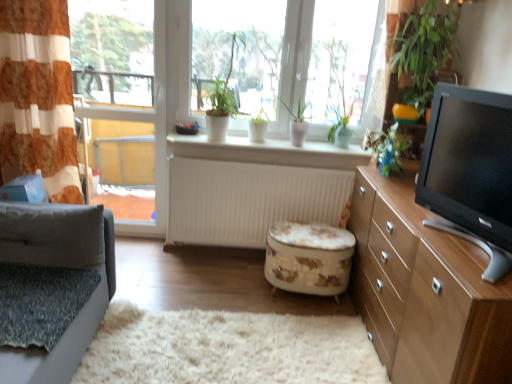
This screenshot has width=512, height=384. Describe the element at coordinates (470, 170) in the screenshot. I see `black glossy tv at right` at that location.

Where is `black glossy tv at right`? The width and height of the screenshot is (512, 384). black glossy tv at right is located at coordinates coord(470,170).

The height and width of the screenshot is (384, 512). What do you see at coordinates (425, 291) in the screenshot? I see `light brown wood cabinet at right` at bounding box center [425, 291].

Image resolution: width=512 pixels, height=384 pixels. Describe the element at coordinates (38, 96) in the screenshot. I see `orange striped fabric at left` at that location.

The image size is (512, 384). I want to click on floral-patterned fabric ottoman at center, so click(x=309, y=258).

Describe the element at coordinates (387, 148) in the screenshot. I see `green matte plant at upper right, marked as the second plant in a top-to-bottom arrangement` at that location.

Find the location of `clear glass window at left`. clear glass window at left is located at coordinates 139,109.

Describe the element at coordinates (423, 51) in the screenshot. I see `green leafy plant at upper right` at that location.

This screenshot has width=512, height=384. What are the coordinates of `white matte window sill at center` in the screenshot? It's located at (268, 152).

From the image's perspective, is white glossy plants at upper center located above or below black glossy tv at right?

Clearly, from the image's perspective, white glossy plants at upper center is above black glossy tv at right.

From a real-world perspective, is white glossy plants at upper center positioned above or below black glossy tv at right?

white glossy plants at upper center is situated higher than black glossy tv at right in the real world.

Does white matte window sill at center have a smaller size compared to gray fabric studio couch at left?

Correct, white matte window sill at center occupies less space than gray fabric studio couch at left.

Is white matte window sill at center thinner than gray fabric studio couch at left?

Indeed, white matte window sill at center has a lesser width compared to gray fabric studio couch at left.

Which object is further away from the camera taking this photo, white matte window sill at center or gray fabric studio couch at left?

white matte window sill at center.

At what (x,y) coordinates should I click in order to perform the action: click on studio couch below the white matte window sill at center (from the image's perspective). Please return your answer as a coordinate pair (x, y). The image size is (512, 384). Looking at the image, I should click on (51, 287).

Identify the location of plant that is the 2nd object located above the light brown wood cabinet at right (from the image's perspective). (225, 86).

Between light brown wood cabinet at right and green matte plant at center, positioned as the 1th plant in top-to-bottom order, which one has more height?

With more height is light brown wood cabinet at right.

Which point is more forward, (372,326) or (213,103)?

The point (372,326) is closer.

Is point (53, 103) behind point (364, 231)?

That is True.

Would you say orange striped fabric at left is inside or outside light brown wood cabinet at right?

orange striped fabric at left is not inside light brown wood cabinet at right, it's outside.

Considering the relative sizes of orange striped fabric at left and light brown wood cabinet at right in the image provided, is orange striped fabric at left smaller than light brown wood cabinet at right?

Yes.

Is orange striped fabric at left aimed at light brown wood cabinet at right?

No, orange striped fabric at left is not facing towards light brown wood cabinet at right.

In the image, is floral-patterned fabric ottoman at center positioned in front of or behind green leafy plant at upper right?

floral-patterned fabric ottoman at center is behind green leafy plant at upper right.

Considering the positions of point (329, 257) and point (395, 52), is point (329, 257) closer or farther from the camera than point (395, 52)?

Point (329, 257) appears to be closer to the viewer than point (395, 52).

Does floral-patterned fabric ottoman at center touch green leafy plant at upper right?

No, floral-patterned fabric ottoman at center is not next to green leafy plant at upper right.

From the image's perspective, relative to green leafy plant at upper right, is floral-patterned fabric ottoman at center above or below?

From the image's perspective, floral-patterned fabric ottoman at center appears below green leafy plant at upper right.

Relative to green matte plant at upper right, the 2th plant when ordered from left to right, is orange striped fabric at left in front or behind?

Visually, orange striped fabric at left is located in front of green matte plant at upper right, the 2th plant when ordered from left to right.

Which of these two, orange striped fabric at left or green matte plant at upper right, marked as the second plant in a top-to-bottom arrangement, stands shorter?

With less height is green matte plant at upper right, marked as the second plant in a top-to-bottom arrangement.

Would you say orange striped fabric at left is to the left or to the right of green matte plant at upper right, marked as the first plant in a right-to-left arrangement, in the picture?

orange striped fabric at left is positioned on green matte plant at upper right, marked as the first plant in a right-to-left arrangement,'s left side.

Is green matte plant at upper right, which ranks as the 1th plant in bottom-to-top order, at the back of orange striped fabric at left?

No, orange striped fabric at left is not facing the opposite direction of green matte plant at upper right, which ranks as the 1th plant in bottom-to-top order.

Is green matte plant at upper right, which ranks as the 1th plant in bottom-to-top order, smaller than green leafy plant at upper right?

Yes.

Considering their positions, is green matte plant at upper right, the 2th plant when ordered from left to right, located in front of or behind green leafy plant at upper right?

green matte plant at upper right, the 2th plant when ordered from left to right, is positioned farther from the viewer than green leafy plant at upper right.

Where is `plant that is the 1st object located behind the green leafy plant at upper right`? The width and height of the screenshot is (512, 384). plant that is the 1st object located behind the green leafy plant at upper right is located at coordinates (387, 148).

Identify the location of television in front of the white glossy plants at upper center. (470, 170).

Image resolution: width=512 pixels, height=384 pixels. In order to click on window sill to the right of gray fabric studio couch at left in this screenshot , I will do `click(268, 152)`.

Estimate the real-world distances between objects in this image. Which object is further from green matte plant at upper right, which ranks as the 1th plant in bottom-to-top order, white glossy plants at upper center or gray fabric studio couch at left?

Among the two, gray fabric studio couch at left is located further to green matte plant at upper right, which ranks as the 1th plant in bottom-to-top order.

Estimate the real-world distances between objects in this image. Which object is further from white matte window sill at center, white matte radiator at center or orange striped fabric at left?

Among the two, orange striped fabric at left is located further to white matte window sill at center.

Estimate the real-world distances between objects in this image. Which object is further from floral-patterned fabric ottoman at center, black glossy tv at right or green leafy plant at upper right?

The object further to floral-patterned fabric ottoman at center is green leafy plant at upper right.

When comparing their distances from light brown wood cabinet at right, does black glossy tv at right or gray fabric studio couch at left seem further?

Among the two, gray fabric studio couch at left is located further to light brown wood cabinet at right.

When comparing their distances from green matte plant at center, the second plant positioned from the bottom, does light brown wood cabinet at right or green matte plant at upper right, which ranks as the 1th plant in bottom-to-top order, seem closer?

Among the two, green matte plant at upper right, which ranks as the 1th plant in bottom-to-top order, is located nearer to green matte plant at center, the second plant positioned from the bottom.

Considering their positions, is white matte radiator at center positioned further to white matte window sill at center than black glossy tv at right?

Among the two, black glossy tv at right is located further to white matte window sill at center.

Which object lies further to the anchor point white matte radiator at center, gray fabric studio couch at left or light brown wood cabinet at right?

The object further to white matte radiator at center is gray fabric studio couch at left.

From the image, which object appears to be nearer to orange striped fabric at left, light brown wood cabinet at right or green matte plant at upper right, the 2th plant when ordered from left to right?

green matte plant at upper right, the 2th plant when ordered from left to right, is positioned closer to the anchor orange striped fabric at left.

This screenshot has width=512, height=384. Find the location of `curtain positioned between gray fabric studio couch at left and white matte window sill at center from near to far`. curtain positioned between gray fabric studio couch at left and white matte window sill at center from near to far is located at coordinates (38, 96).

You are a GUI agent. You are given a task and a screenshot of the screen. Output one action in this format:
    pyautogui.click(x=<x>, y=<y>)
    Task: Click on the window sill between clear glass window at left and green leafy plant at upper right from left to right
    The image size is (512, 384).
    Given the screenshot: What is the action you would take?
    pyautogui.click(x=268, y=152)

Where is `window sill situated between orange striped fabric at left and floral-patterned fabric ottoman at center from left to right`? window sill situated between orange striped fabric at left and floral-patterned fabric ottoman at center from left to right is located at coordinates (268, 152).

Image resolution: width=512 pixels, height=384 pixels. I want to click on stool situated between orange striped fabric at left and black glossy tv at right from left to right, so click(x=309, y=258).